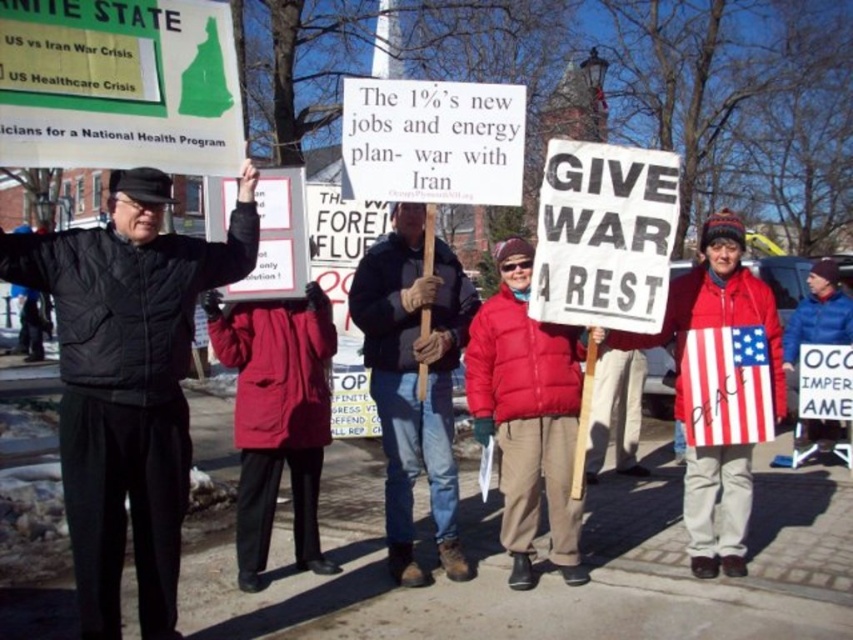
Question: Which object is the closest to the dark blue jacket at center?

Choices:
 (A) american flag at center
 (B) black matte jacket at left

Answer: (B)

Question: Does dark blue jacket at center appear on the right side of american flag at center?

Choices:
 (A) no
 (B) yes

Answer: (A)

Question: From the image, what is the correct spatial relationship of dark blue jacket at center in relation to american flag at center?

Choices:
 (A) left
 (B) right

Answer: (A)

Question: Is black matte jacket at left to the right of american flag at center from the viewer's perspective?

Choices:
 (A) yes
 (B) no

Answer: (B)

Question: Which object appears closest to the camera in this image?

Choices:
 (A) american flag at center
 (B) black matte jacket at left
 (C) dark blue jacket at center

Answer: (B)

Question: Among these objects, which one is nearest to the camera?

Choices:
 (A) american flag at center
 (B) black matte jacket at left

Answer: (B)